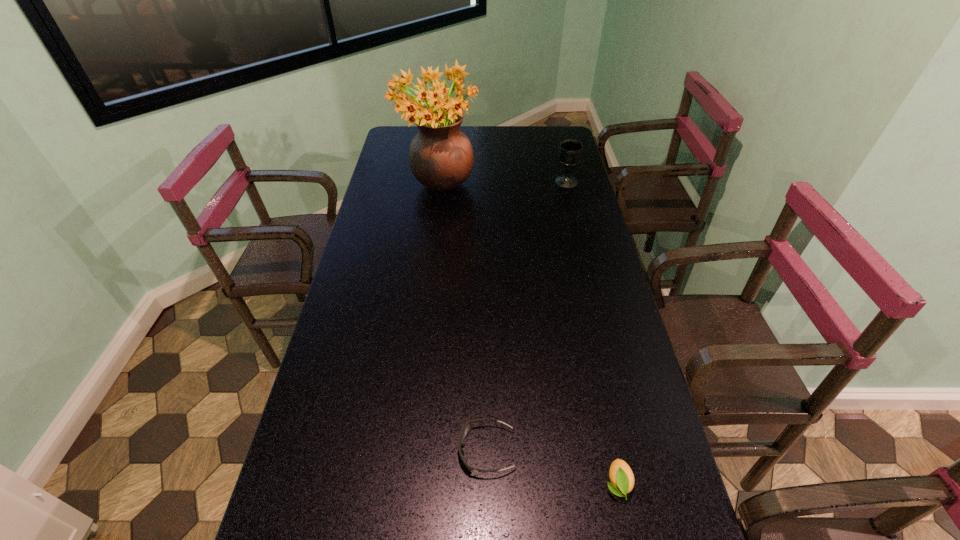
You are a GUI agent. You are given a task and a screenshot of the screen. Output one action in this format:
    pyautogui.click(x=<x>, y=<y>)
    Task: Click on the vacant space in between the second shortest object and the goggles
    The image size is (960, 540).
    Given the screenshot: What is the action you would take?
    pyautogui.click(x=552, y=467)

Locate an element on the screen. vacant area between the goggles and the tallest object is located at coordinates (463, 320).

This screenshot has width=960, height=540. I want to click on free spot between the shortest object and the tallest object, so click(463, 320).

This screenshot has height=540, width=960. In order to click on empty location between the tallest object and the lemon in this screenshot , I will do `click(528, 336)`.

Find the location of `free space between the goggles and the flower arrangement`. free space between the goggles and the flower arrangement is located at coordinates (463, 320).

Where is `vacant area that lies between the goggles and the flower arrangement`? This screenshot has height=540, width=960. vacant area that lies between the goggles and the flower arrangement is located at coordinates (463, 320).

You are a GUI agent. You are given a task and a screenshot of the screen. Output one action in this format:
    pyautogui.click(x=<x>, y=<y>)
    Task: Click on the second closest object relative to the goggles
    
    Given the screenshot: What is the action you would take?
    pyautogui.click(x=441, y=158)

Point out which object is positioned as the third nearest to the second shortest object. Please provide its 2D coordinates. Your answer should be formatted as a tuple, i.e. [(x, y)], where the tuple contains the x and y coordinates of a point satisfying the conditions above.

[(570, 151)]

Identify the location of free space that satisfies the following two spatial constraints: 1. on the back side of the chalice; 2. on the right side of the tallest object. (441, 182).